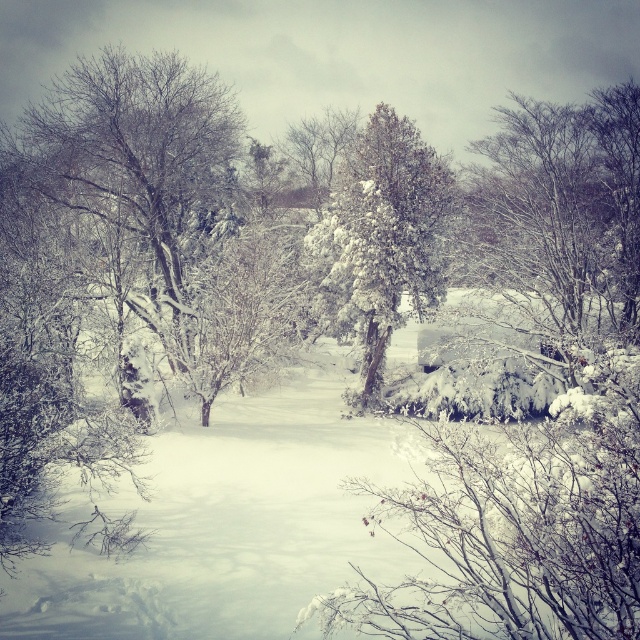
Question: Is white snow-covered tree at upper right thinner than snow-covered evergreen at center?

Choices:
 (A) no
 (B) yes

Answer: (A)

Question: Among these points, which one is farthest from the camera?

Choices:
 (A) (x=396, y=134)
 (B) (x=528, y=100)

Answer: (B)

Question: Is white snow-covered tree at upper right to the left of snow-covered evergreen at center from the viewer's perspective?

Choices:
 (A) no
 (B) yes

Answer: (A)

Question: Which of the following is the farthest from the observer?

Choices:
 (A) (502, 216)
 (B) (376, 113)

Answer: (B)

Question: Does white snow-covered tree at upper right appear under snow-covered evergreen at center?

Choices:
 (A) no
 (B) yes

Answer: (A)

Question: Which of the following is the farthest from the observer?

Choices:
 (A) (356, 248)
 (B) (598, 202)

Answer: (B)